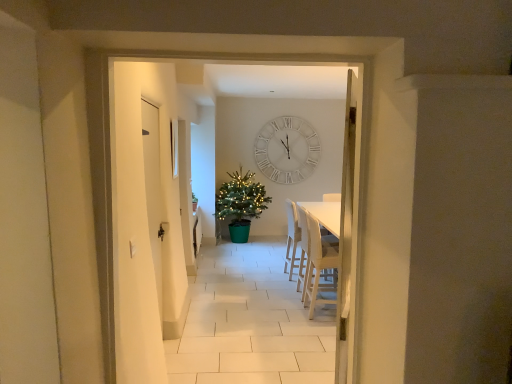
Question: Is light beige fabric armchair at right, the 1th armchair positioned from the front, not inside white matte wall clock at center?

Choices:
 (A) yes
 (B) no

Answer: (A)

Question: From the image's perspective, does light beige fabric armchair at right, the 1th armchair positioned from the front, appear higher than white matte wall clock at center?

Choices:
 (A) yes
 (B) no

Answer: (B)

Question: Considering the relative sizes of light beige fabric armchair at right, the second armchair viewed from the back, and white matte wall clock at center in the image provided, is light beige fabric armchair at right, the second armchair viewed from the back, wider than white matte wall clock at center?

Choices:
 (A) no
 (B) yes

Answer: (B)

Question: Is light beige fabric armchair at right, the second armchair viewed from the back, thinner than white matte wall clock at center?

Choices:
 (A) no
 (B) yes

Answer: (A)

Question: Is light beige fabric armchair at right, the 1th armchair positioned from the front, at the right side of white matte wall clock at center?

Choices:
 (A) no
 (B) yes

Answer: (B)

Question: Considering the positions of light beige fabric armchair at right, the 1th armchair positioned from the front, and green plastic christmas tree at center in the image, is light beige fabric armchair at right, the 1th armchair positioned from the front, taller or shorter than green plastic christmas tree at center?

Choices:
 (A) short
 (B) tall

Answer: (A)

Question: Considering the positions of point (317, 233) and point (242, 218), is point (317, 233) closer or farther from the camera than point (242, 218)?

Choices:
 (A) closer
 (B) farther

Answer: (A)

Question: Relative to green plastic christmas tree at center, is light beige fabric armchair at right, the second armchair viewed from the back, in front or behind?

Choices:
 (A) behind
 (B) front

Answer: (B)

Question: Looking at the image, does light beige fabric armchair at right, the second armchair viewed from the back, seem bigger or smaller compared to green plastic christmas tree at center?

Choices:
 (A) big
 (B) small

Answer: (B)

Question: From a real-world perspective, is white matte wall clock at center positioned above or below white matte door at left?

Choices:
 (A) above
 (B) below

Answer: (A)

Question: Would you say white matte wall clock at center is to the left or to the right of white matte door at left in the picture?

Choices:
 (A) left
 (B) right

Answer: (B)

Question: Considering their positions, is white matte wall clock at center located in front of or behind white matte door at left?

Choices:
 (A) front
 (B) behind

Answer: (B)

Question: From the image's perspective, is white matte wall clock at center above or below white matte door at left?

Choices:
 (A) above
 (B) below

Answer: (A)

Question: From the image's perspective, is light beige fabric armchair at right, the second armchair viewed from the back, above or below white matte wall clock at center?

Choices:
 (A) above
 (B) below

Answer: (B)

Question: Considering their positions, is light beige fabric armchair at right, the second armchair viewed from the back, located in front of or behind white matte wall clock at center?

Choices:
 (A) behind
 (B) front

Answer: (B)